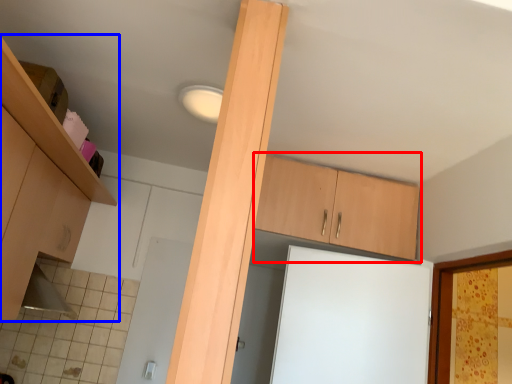
Question: Which point is closer to the camera, cabinetry (highlighted by a red box) or cabinetry (highlighted by a blue box)?

Choices:
 (A) cabinetry
 (B) cabinetry

Answer: (B)